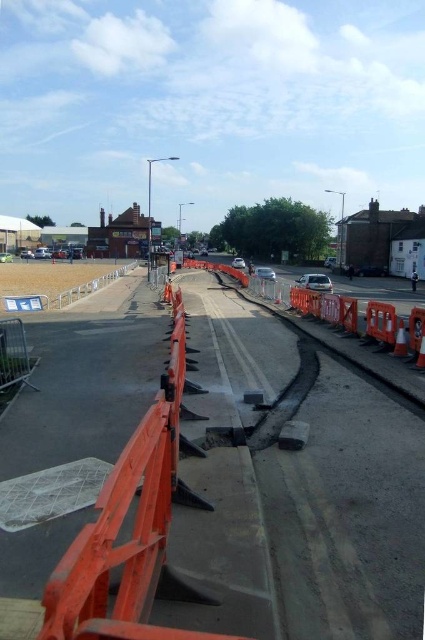
You are a construction worker who needs to ensure safety by placing a warning sign. The sign must be placed on the taller object between the orange plastic barrier at center and the orange plastic traffic cone at right. Which object should you choose?

The orange plastic barrier at center is taller than the orange plastic traffic cone at right, so you should place the warning sign on the orange plastic barrier at center.

You are a delivery driver with a truck that is 3.5 meters wide. You need to pass through the construction site shown. The truck must stay within the marked lanes and avoid hitting any barriers or cones. Is there enough space between the orange plastic barrier at center and the orange plastic traffic cone at right for your truck to pass through?

The distance between the orange plastic barrier at center and the orange plastic traffic cone at right is 4.21 meters. Since your truck is 3.5 meters wide, there is sufficient space for it to pass through without hitting either barrier or cone.

You are a city inspector checking the construction site. You need to ensure that the orange plastic barrier at center and the orange plastic traffic cone at right are placed correctly. Which object is wider?

The orange plastic barrier at center is wider than the orange plastic traffic cone at right.